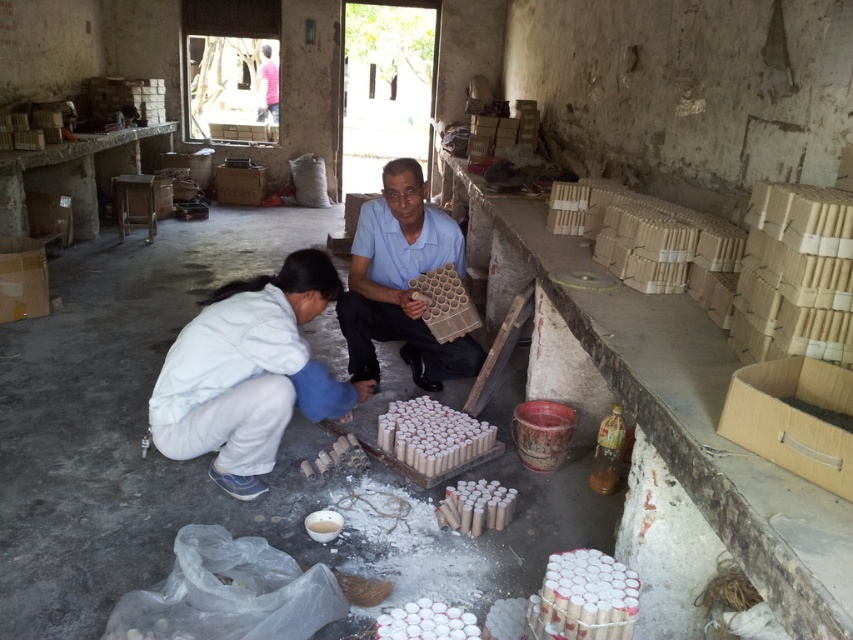
Question: Does white matte jacket at lower left have a greater width compared to matte cardboard tray at center?

Choices:
 (A) no
 (B) yes

Answer: (B)

Question: Which object is closer to the camera taking this photo?

Choices:
 (A) white matte egg at center
 (B) matte cardboard tray at center
 (C) white matte cylinder at center

Answer: (A)

Question: Does matte cardboard tray at center appear on the right side of white matte egg at center?

Choices:
 (A) yes
 (B) no

Answer: (B)

Question: Can you confirm if white matte jacket at lower left is positioned above white matte egg at center?

Choices:
 (A) yes
 (B) no

Answer: (A)

Question: Which point is farther to the camera?

Choices:
 (A) (473, 340)
 (B) (192, 429)

Answer: (A)

Question: Based on their relative distances, which object is nearer to the white matte cylinder at center?

Choices:
 (A) white matte egg at center
 (B) matte cardboard tray at center
 (C) white matte jacket at lower left

Answer: (C)